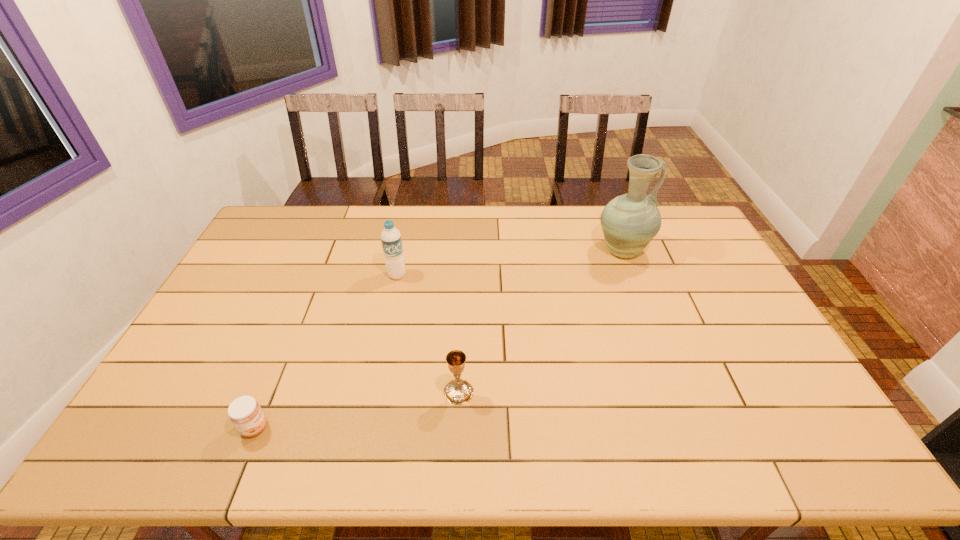
Identify the location of unoccupied position between the water bottle and the rightmost object. (510, 263).

Where is `unoccupied position between the chalice and the third object from right to left`? The height and width of the screenshot is (540, 960). unoccupied position between the chalice and the third object from right to left is located at coordinates (428, 333).

Locate an element on the screen. The image size is (960, 540). free space between the second tallest object and the jam is located at coordinates (325, 351).

Find the location of `vacant region between the pitcher and the second object from left to right`. vacant region between the pitcher and the second object from left to right is located at coordinates (510, 263).

Image resolution: width=960 pixels, height=540 pixels. Identify the location of blank region between the tallest object and the shortest object. (439, 339).

In order to click on vacant area between the water bottle and the chalice in this screenshot , I will do `click(428, 333)`.

Locate an element on the screen. The width and height of the screenshot is (960, 540). free area in between the third shortest object and the jam is located at coordinates (325, 351).

Identify the location of vacant point located between the water bottle and the pitcher. (510, 263).

Image resolution: width=960 pixels, height=540 pixels. I want to click on empty location between the second shortest object and the water bottle, so click(428, 333).

Select which object appears as the third closest to the second tallest object. Please provide its 2D coordinates. Your answer should be formatted as a tuple, i.e. [(x, y)], where the tuple contains the x and y coordinates of a point satisfying the conditions above.

[(630, 221)]